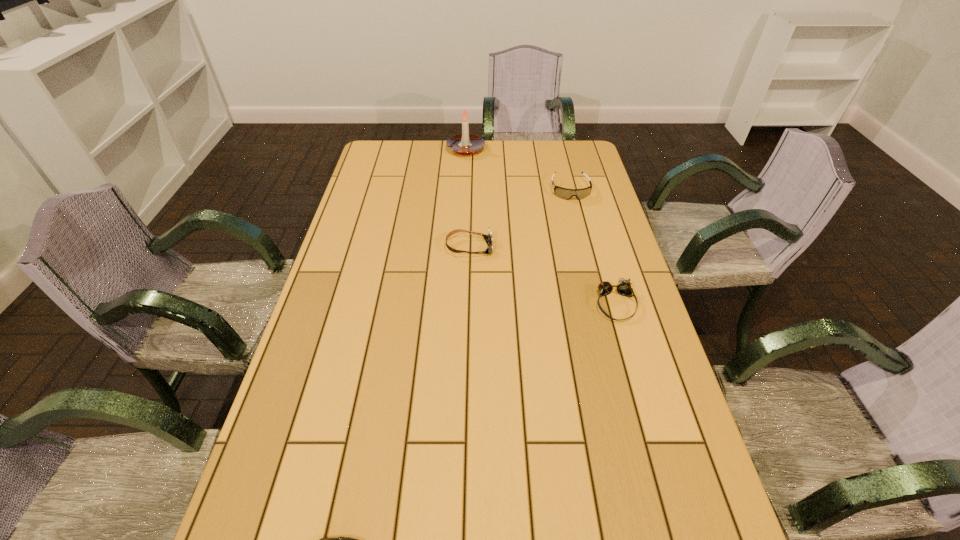
Locate an element on the screen. the tallest object is located at coordinates [465, 144].

What are the coordinates of `candle` in the screenshot? It's located at [465, 144].

This screenshot has height=540, width=960. Identify the location of the farthest goggles. (564, 193).

You are a GUI agent. You are given a task and a screenshot of the screen. Output one action in this format:
    pyautogui.click(x=<x>, y=<y>)
    Task: Click on the third farthest object
    The image size is (960, 540).
    Given the screenshot: What is the action you would take?
    pyautogui.click(x=488, y=238)

The image size is (960, 540). What are the coordinates of `the second nearest goggles` in the screenshot? It's located at point(488,238).

Identify the location of the second nearest object. This screenshot has height=540, width=960. (623, 287).

The width and height of the screenshot is (960, 540). In order to click on vacant point located on the right of the farthest object in this screenshot , I will do `click(516, 149)`.

Find the location of a particular element. The width and height of the screenshot is (960, 540). vacant space located 0.400m on the front and sides of the fourth nearest object is located at coordinates (594, 284).

Where is `vacant space located 0.260m on the front-facing side of the second farthest goggles`? This screenshot has height=540, width=960. vacant space located 0.260m on the front-facing side of the second farthest goggles is located at coordinates (576, 247).

The width and height of the screenshot is (960, 540). I want to click on vacant space located through the lenses of the fourth farthest object, so (x=642, y=398).